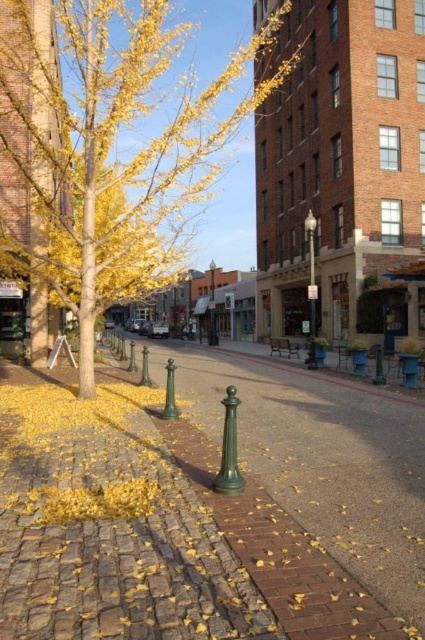
Question: Which object appears closest to the camera in this image?

Choices:
 (A) yellow leafy tree at center
 (B) polished metal lamp post at center
 (C) green metallic lamp post at center

Answer: (A)

Question: Which object is the farthest from the brick pavement at center?

Choices:
 (A) green metallic lamp post at center
 (B) yellow leafy tree at center
 (C) polished metal lamp post at center

Answer: (B)

Question: Can you confirm if brick pavement at center is positioned above polished metal lamp post at center?

Choices:
 (A) yes
 (B) no

Answer: (B)

Question: Where is polished metal lamp post at center located in relation to green metallic lamp post at center in the image?

Choices:
 (A) right
 (B) left

Answer: (A)

Question: Based on their relative distances, which object is nearer to the polished metal lamp post at center?

Choices:
 (A) green metallic lamp post at center
 (B) yellow leafy tree at center

Answer: (A)

Question: Does yellow leafy tree at center have a lesser width compared to polished metal lamp post at center?

Choices:
 (A) no
 (B) yes

Answer: (A)